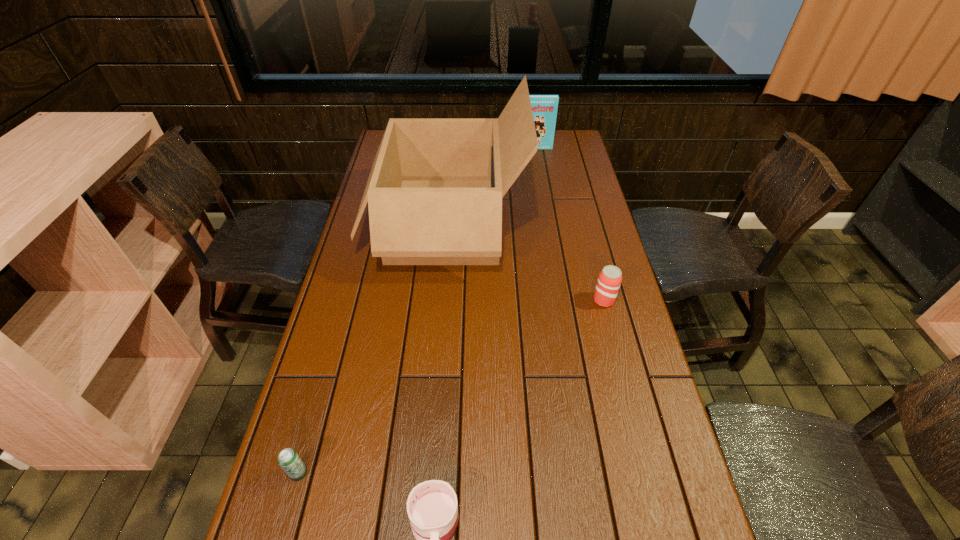
Locate an element on the screen. This screenshot has width=960, height=540. blank space located on the front of the right beer can is located at coordinates (612, 332).

The width and height of the screenshot is (960, 540). I want to click on free location located 0.280m on the right of the left beer can, so click(x=441, y=473).

Where is `object positioned at the far edge`? object positioned at the far edge is located at coordinates (544, 107).

Find the location of a particular element. The width and height of the screenshot is (960, 540). box located in the left edge section of the desktop is located at coordinates (435, 189).

Find the location of a particular element. This screenshot has width=960, height=540. beer can at the left edge is located at coordinates (288, 459).

Find the location of `book that is positioned at the right edge`. book that is positioned at the right edge is located at coordinates (544, 107).

This screenshot has width=960, height=540. In order to click on beer can positioned at the right edge in this screenshot , I will do `click(610, 278)`.

The height and width of the screenshot is (540, 960). What are the coordinates of `object present at the far right corner` in the screenshot? It's located at (544, 107).

Image resolution: width=960 pixels, height=540 pixels. In the image, there is a desktop. Find the location of `vacant space at the left edge`. vacant space at the left edge is located at coordinates coord(334,489).

I want to click on vacant area at the right edge, so click(609, 368).